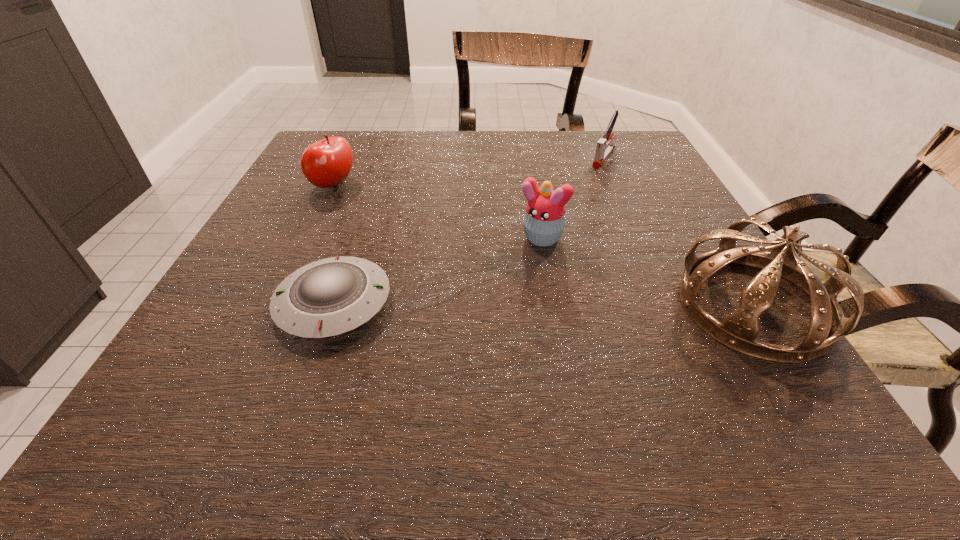
Locate an element on the screen. This screenshot has width=960, height=540. free space on the desktop that is between the saucer and the tallest object and is positioned on the handle side of the fourth tallest object is located at coordinates pyautogui.click(x=482, y=304).

The width and height of the screenshot is (960, 540). Find the location of `free spot on the desktop that is between the shortest object and the tiara and is positioned on the face of the third object from right to left`. free spot on the desktop that is between the shortest object and the tiara and is positioned on the face of the third object from right to left is located at coordinates (492, 304).

You are a GUI agent. You are given a task and a screenshot of the screen. Output one action in this format:
    pyautogui.click(x=<x>, y=<y>)
    Task: Click on the vacant space on the desktop that is between the shortest object and the tallest object and is positioned on the stem of the apple
    The width and height of the screenshot is (960, 540).
    Given the screenshot: What is the action you would take?
    pyautogui.click(x=563, y=305)